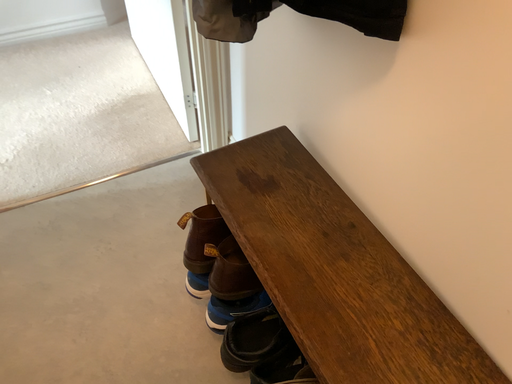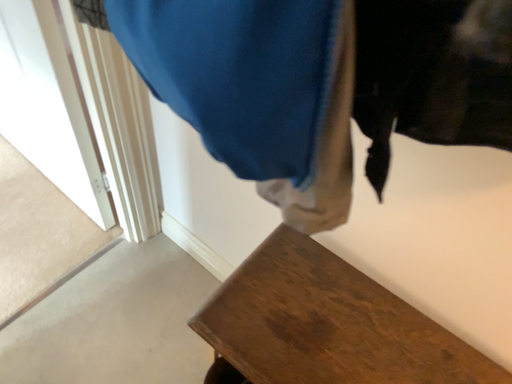
Question: Which way did the camera rotate in the video?

Choices:
 (A) rotated left
 (B) rotated right

Answer: (B)